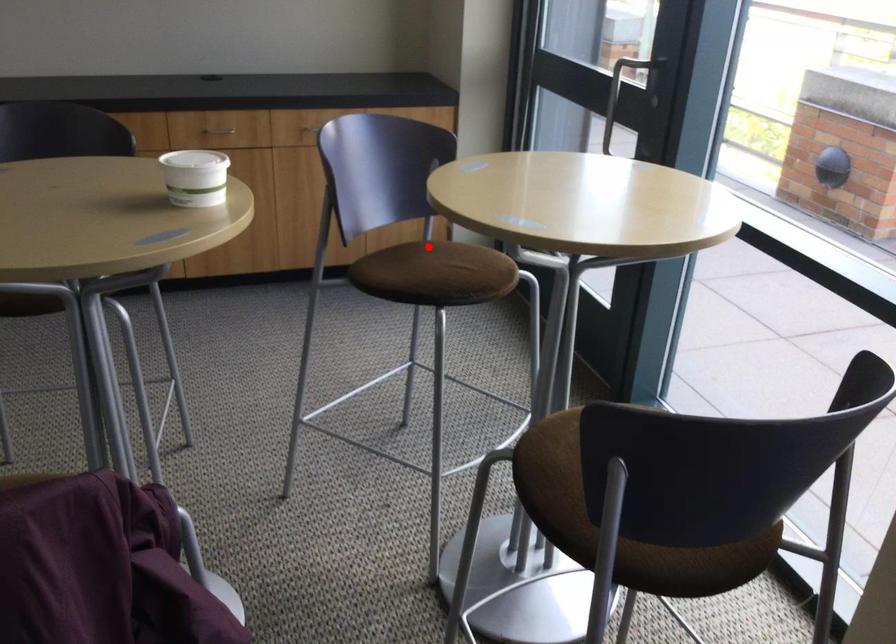
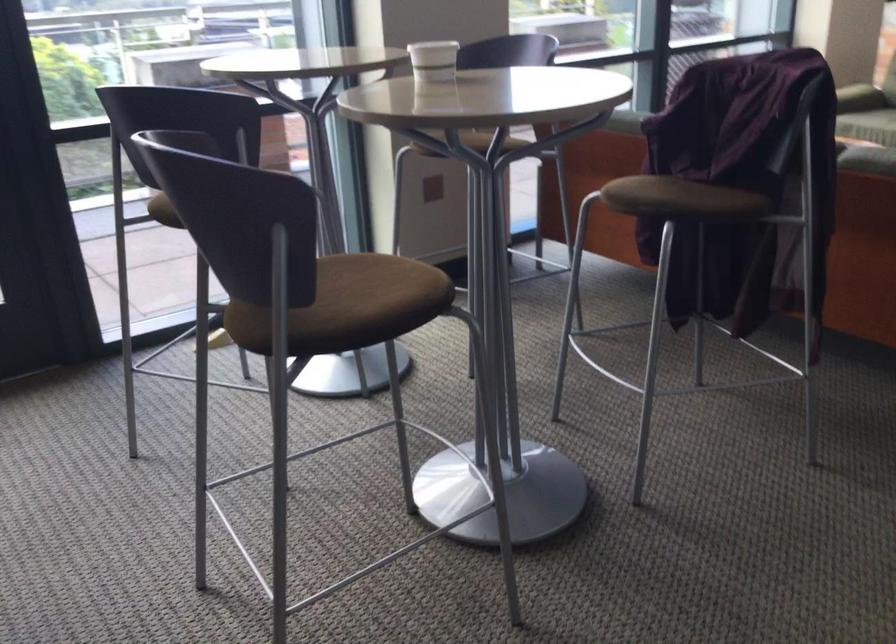
Locate, in the second image, the point that corresponds to the highlighted location in the first image.

(162, 211)